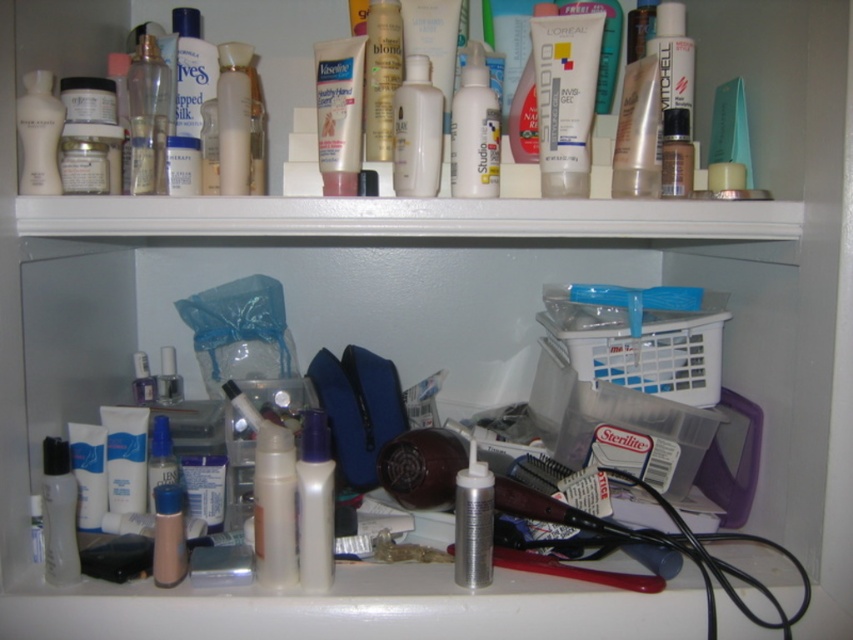
Which is behind, point (271, 529) or point (225, 49)?

The point (225, 49) is more distant.

Is point (289, 544) closer to camera compared to point (231, 113)?

Yes, it is.

Which is behind, point (265, 579) or point (242, 52)?

The point (242, 52) is behind.

Locate an element on the screen. This screenshot has height=640, width=853. translucent plastic lotion at center is located at coordinates (274, 506).

Does matte white tube at upper center appear under white matte toothpaste at lower left?

No, matte white tube at upper center is not below white matte toothpaste at lower left.

Between matte white tube at upper center and white matte toothpaste at lower left, which one is positioned lower?

white matte toothpaste at lower left

Is point (532, 51) less distant than point (119, 426)?

Yes, point (532, 51) is in front of point (119, 426).

Locate an element on the screen. The image size is (853, 640). matte white tube at upper center is located at coordinates (566, 99).

Who is lower down, silver metallic spray can at center or clear plastic nail polish at center?

silver metallic spray can at center

Which of these two, silver metallic spray can at center or clear plastic nail polish at center, stands shorter?

clear plastic nail polish at center

Find the location of a particular element. The height and width of the screenshot is (640, 853). silver metallic spray can at center is located at coordinates (473, 522).